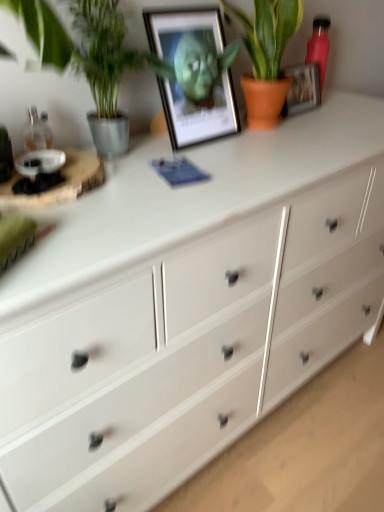
This screenshot has width=384, height=512. I want to click on vacant area that is situated to the right of metallic framed picture at upper center, so click(278, 145).